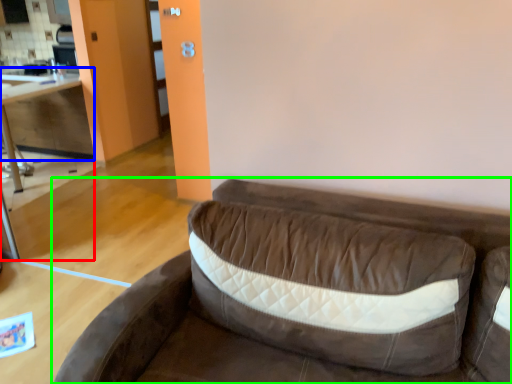
Question: Which is farther away from table (highlighted by a red box)? cabinetry (highlighted by a blue box) or studio couch (highlighted by a green box)?

Choices:
 (A) cabinetry
 (B) studio couch

Answer: (B)